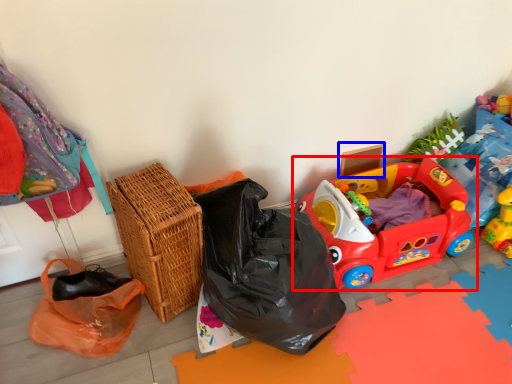
Question: Which object is closer to the camera taking this photo, toy (highlighted by a red box) or cardboard box (highlighted by a blue box)?

Choices:
 (A) toy
 (B) cardboard box

Answer: (A)